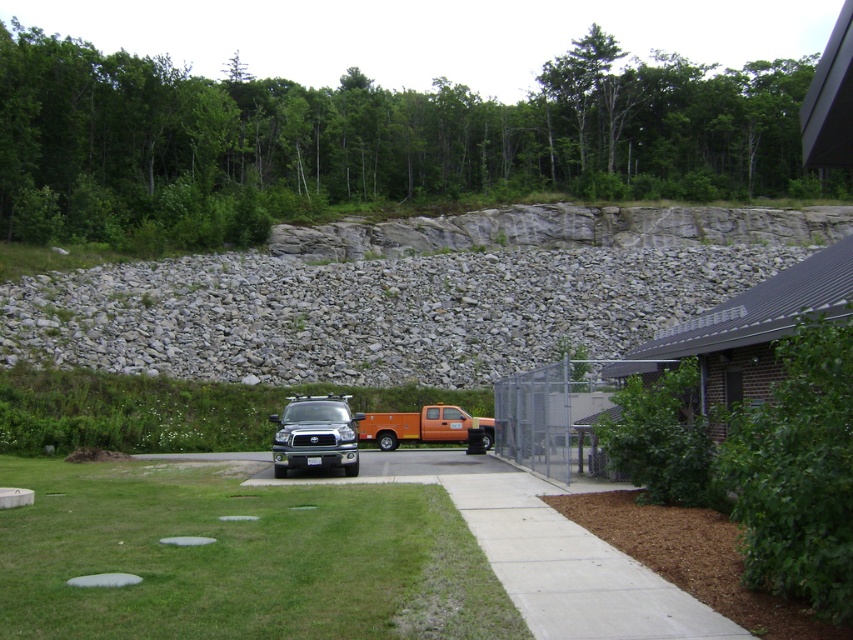
You are a delivery person trying to park your van between the green grass at lower left and the orange matte truck at center. Based on the scene, can you safely park there without blocking the pathway?

The green grass at lower left is in front of the orange matte truck at center, so parking between them might block the pathway since the grass is closer to the front. Choose another spot to avoid obstruction.

In the scene shown: You are a gardener planning to mow the green grass at lower left and the matte black truck at center. Which area requires a wider mower blade to accommodate the width?

The green grass at lower left requires a wider mower blade since its width is greater than the matte black truck at center.

You are planning to set up a small tent for an event. You have two options for placement based on the image provided. The first option is on the green grass at lower left, and the second is near the matte black truck at center. Considering the size of the areas, which location would allow for a larger tent setup?

The green grass at lower left is bigger than the matte black truck at center, so the larger tent setup would fit better on the green grass at lower left.